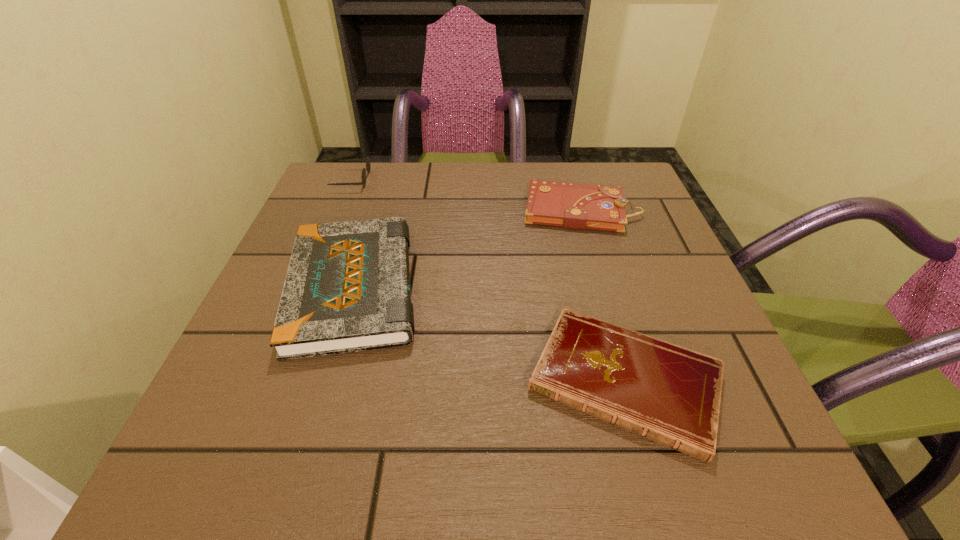
At what (x,y) coordinates should I click in order to perform the action: click on sunglasses. Please return your answer as a coordinate pair (x, y). This screenshot has width=960, height=540. Looking at the image, I should click on click(368, 165).

You are a GUI agent. You are given a task and a screenshot of the screen. Output one action in this format:
    pyautogui.click(x=<x>, y=<y>)
    Task: Click on the leftmost notebook
    
    Given the screenshot: What is the action you would take?
    pyautogui.click(x=347, y=289)

Locate an element on the screen. the second shortest notebook is located at coordinates (579, 206).

The width and height of the screenshot is (960, 540). What are the coordinates of `the shortest notebook` in the screenshot? It's located at coord(669,394).

Locate an element on the screen. Image resolution: width=960 pixels, height=540 pixels. free spot located 0.250m on the front-facing side of the sunglasses is located at coordinates (468, 180).

Locate an element on the screen. This screenshot has width=960, height=540. vacant position located on the right of the leftmost notebook is located at coordinates (588, 288).

Find the location of a particular element. The width and height of the screenshot is (960, 540). free space located on the left of the second shortest notebook is located at coordinates (348, 210).

Find the location of `free point located on the left of the shortest object`. free point located on the left of the shortest object is located at coordinates (435, 381).

This screenshot has width=960, height=540. Find the location of `sunglasses located at the far edge`. sunglasses located at the far edge is located at coordinates (368, 165).

This screenshot has height=540, width=960. In order to click on notebook that is at the far edge in this screenshot , I will do `click(579, 206)`.